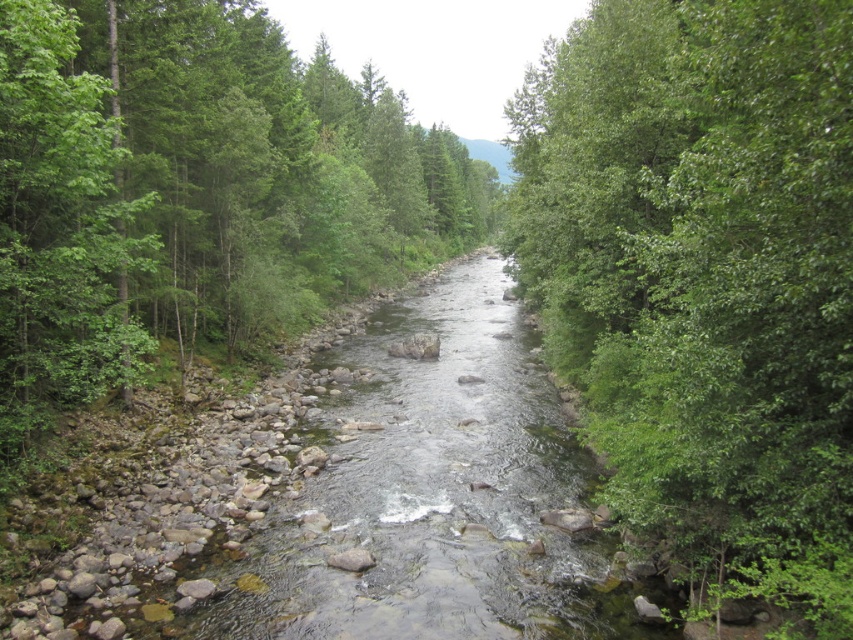
Between point (631, 349) and point (0, 28), which one is positioned behind?

The point (631, 349) is more distant.

The height and width of the screenshot is (640, 853). I want to click on green leafy tree at right, so click(704, 273).